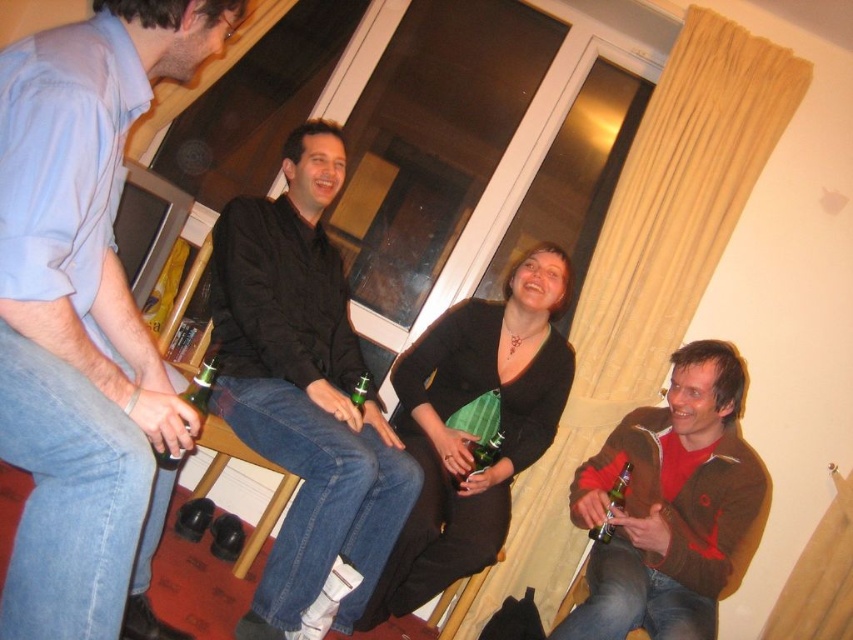
Question: Where is green glass bottle at lower right located in relation to green glass bottle at center in the image?

Choices:
 (A) below
 (B) above

Answer: (A)

Question: Which point appears farthest from the camera in this image?

Choices:
 (A) (590, 536)
 (B) (358, 378)
 (C) (479, 444)
 (D) (299, 269)

Answer: (C)

Question: Which point is farther to the camera?

Choices:
 (A) (497, 305)
 (B) (393, 451)

Answer: (A)

Question: Does black matte dress at center appear on the right side of green glass bottle at lower left?

Choices:
 (A) yes
 (B) no

Answer: (A)

Question: Does green matte bottle at center appear on the left side of green glass bottle at center?

Choices:
 (A) no
 (B) yes

Answer: (A)

Question: Among these points, which one is farthest from the camera?

Choices:
 (A) (369, 385)
 (B) (201, 394)
 (C) (624, 476)

Answer: (A)